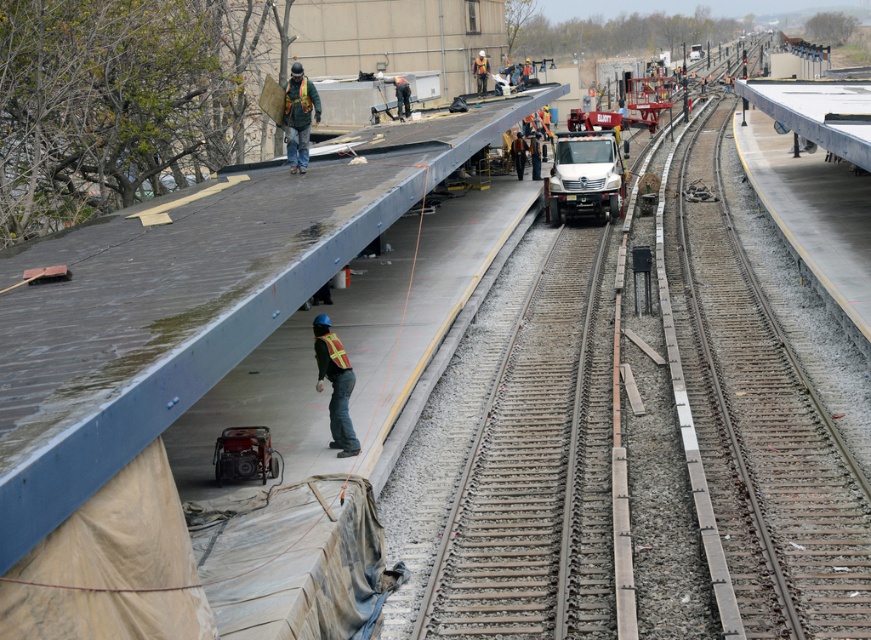
Question: Can you confirm if smooth steel tracks at center is positioned to the left of yellow reflective vest at center?

Choices:
 (A) yes
 (B) no

Answer: (B)

Question: Among these points, which one is farthest from the camera?

Choices:
 (A) (329, 429)
 (B) (717, 134)

Answer: (B)

Question: Does smooth steel tracks at center have a lesser width compared to yellow reflective vest at center?

Choices:
 (A) yes
 (B) no

Answer: (B)

Question: In this image, where is smooth steel tracks at center located relative to yellow reflective vest at center?

Choices:
 (A) left
 (B) right

Answer: (B)